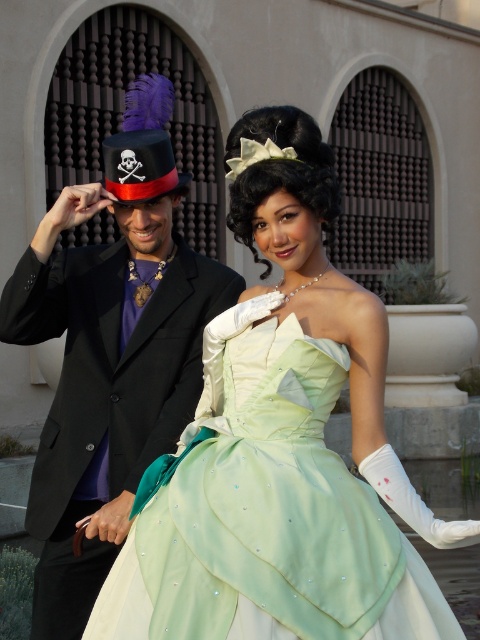
You are a photographer setting up for a photoshoot. You need to ensure that the lime satin dress at center and the matte black dress hat with skull and crossbones at upper left are both visible in the frame. Based on their positions, which object should you focus on first to capture both in the shot?

The lime satin dress at center is positioned under the matte black dress hat with skull and crossbones at upper left. To capture both in the frame, focus on the matte black dress hat with skull and crossbones at upper left first, as it is higher up, ensuring the lower positioned lime satin dress at center remains in view.

You are standing at the point with coordinates point [175,172] and want to move towards the entrance of the building. There is an obstacle at point [87,381]. Can you walk directly towards the entrance without going around the obstacle?

Point [87,381] is in front of point [175,172], so the obstacle is blocking your path. You will need to go around it to reach the entrance.

Looking at this image, you are a photographer setting up for an outdoor event. You need to position two subjects so that they are exactly 5 feet apart. The scene includes a lime satin dress at center and a matte black dress hat with skull and crossbones at upper left. Can you place them at the required distance?

Yes, the lime satin dress at center and the matte black dress hat with skull and crossbones at upper left are already 5.09 feet apart, which meets the requirement of being approximately 5 feet apart.